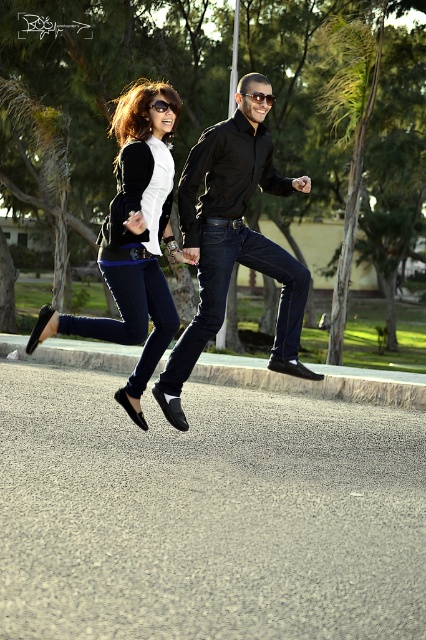
Question: Is matte black shoes at lower left to the left of black plastic goggles at upper center from the viewer's perspective?

Choices:
 (A) no
 (B) yes

Answer: (B)

Question: Can you confirm if matte black shoes at lower left is wider than black plastic goggles at upper center?

Choices:
 (A) yes
 (B) no

Answer: (A)

Question: Which object is farther from the camera taking this photo?

Choices:
 (A) matte black shoes at lower left
 (B) black smooth shirt at center
 (C) dark blue denim jeans at center

Answer: (C)

Question: Which of the following is the farthest from the observer?

Choices:
 (A) (216, 253)
 (B) (253, 99)

Answer: (A)

Question: Is black smooth shirt at center smaller than black plastic goggles at upper center?

Choices:
 (A) no
 (B) yes

Answer: (A)

Question: Which point is closer to the camera taking this photo?

Choices:
 (A) (169, 298)
 (B) (141, 115)

Answer: (B)